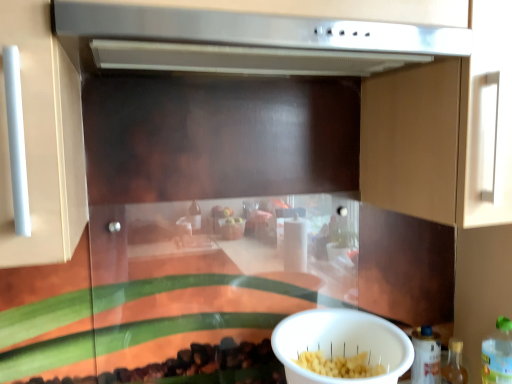
Question: Would you say stainless steel vent at upper center is part of translucent plastic bottle at lower right, which appears as the first bottle when viewed from the left,'s contents?

Choices:
 (A) yes
 (B) no

Answer: (B)

Question: Is translucent plastic bottle at lower right, which appears as the first bottle when viewed from the left, behind stainless steel vent at upper center?

Choices:
 (A) yes
 (B) no

Answer: (A)

Question: Is translucent plastic bottle at lower right, the third bottle in the right-to-left sequence, directly adjacent to stainless steel vent at upper center?

Choices:
 (A) no
 (B) yes

Answer: (A)

Question: Is translucent plastic bottle at lower right, the third bottle in the right-to-left sequence, closer to the viewer compared to stainless steel vent at upper center?

Choices:
 (A) yes
 (B) no

Answer: (B)

Question: Is stainless steel vent at upper center at the back of translucent plastic bottle at lower right, which appears as the first bottle when viewed from the left?

Choices:
 (A) no
 (B) yes

Answer: (A)

Question: Looking at the image, does translucent plastic bottle at lower right, arranged as the second bottle when viewed from the left, seem bigger or smaller compared to stainless steel vent at upper center?

Choices:
 (A) big
 (B) small

Answer: (B)

Question: Is translucent plastic bottle at lower right, positioned as the second bottle in right-to-left order, to the left or to the right of stainless steel vent at upper center in the image?

Choices:
 (A) left
 (B) right

Answer: (B)

Question: Is translucent plastic bottle at lower right, positioned as the second bottle in right-to-left order, taller or shorter than stainless steel vent at upper center?

Choices:
 (A) tall
 (B) short

Answer: (A)

Question: From the image's perspective, is translucent plastic bottle at lower right, positioned as the second bottle in right-to-left order, above or below stainless steel vent at upper center?

Choices:
 (A) above
 (B) below

Answer: (B)

Question: In terms of width, does translucent plastic bottle at lower right, the 1th bottle from the right, look wider or thinner when compared to translucent plastic bottle at lower right, positioned as the second bottle in right-to-left order?

Choices:
 (A) wide
 (B) thin

Answer: (A)

Question: In the image, is translucent plastic bottle at lower right, the third bottle from the left, on the left side or the right side of translucent plastic bottle at lower right, positioned as the second bottle in right-to-left order?

Choices:
 (A) left
 (B) right

Answer: (B)

Question: Considering their positions, is translucent plastic bottle at lower right, the 1th bottle from the right, located in front of or behind translucent plastic bottle at lower right, positioned as the second bottle in right-to-left order?

Choices:
 (A) front
 (B) behind

Answer: (A)

Question: Is translucent plastic bottle at lower right, the third bottle from the left, bigger or smaller than translucent plastic bottle at lower right, positioned as the second bottle in right-to-left order?

Choices:
 (A) big
 (B) small

Answer: (A)

Question: Based on their sizes in the image, would you say translucent plastic bottle at lower right, arranged as the second bottle when viewed from the left, is bigger or smaller than translucent plastic bottle at lower right, the 1th bottle from the right?

Choices:
 (A) small
 (B) big

Answer: (A)

Question: Considering the relative positions of translucent plastic bottle at lower right, arranged as the second bottle when viewed from the left, and translucent plastic bottle at lower right, the third bottle from the left, in the image provided, is translucent plastic bottle at lower right, arranged as the second bottle when viewed from the left, to the left or to the right of translucent plastic bottle at lower right, the third bottle from the left,?

Choices:
 (A) left
 (B) right

Answer: (A)